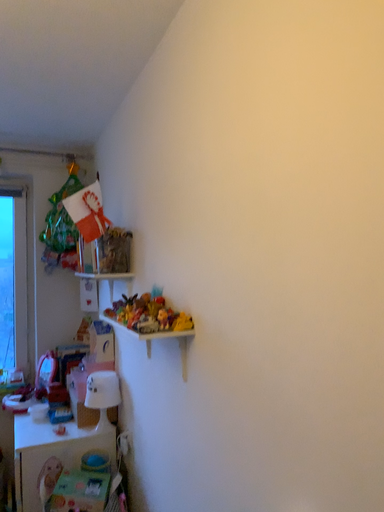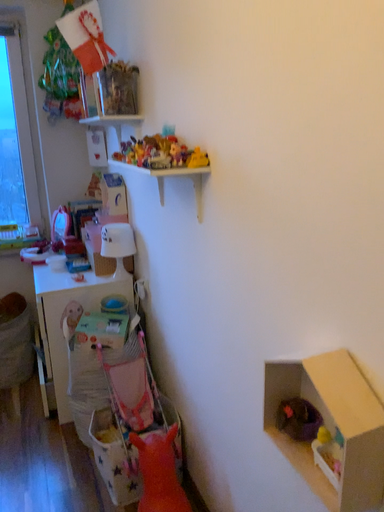
Question: How did the camera likely rotate when shooting the video?

Choices:
 (A) rotated downward
 (B) rotated upward

Answer: (A)